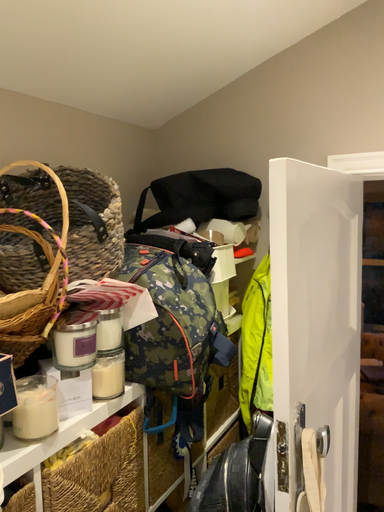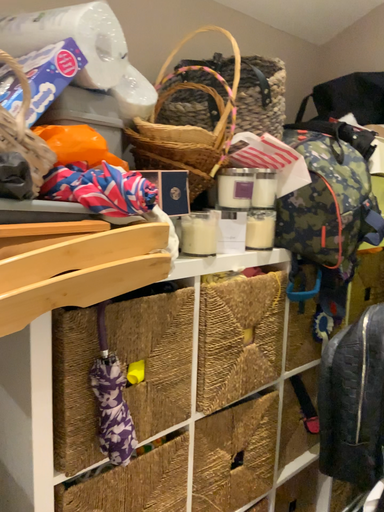
Question: How did the camera likely rotate when shooting the video?

Choices:
 (A) rotated left
 (B) rotated right

Answer: (A)